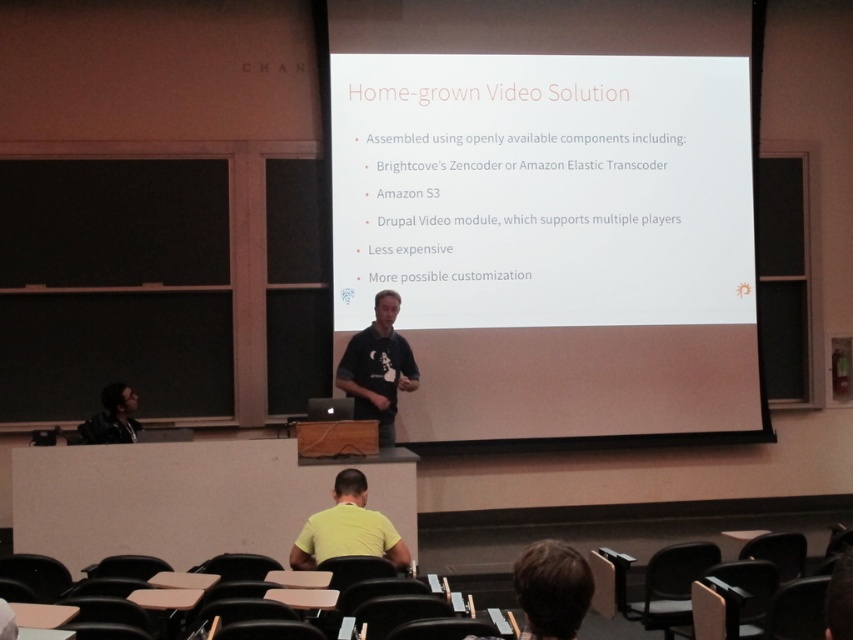
Based on the scene description, where is the white matte projector screen at center located in the classroom?

The white matte projector screen at center is located at point 0.331 on the x axis and 0.647 on the y axis.